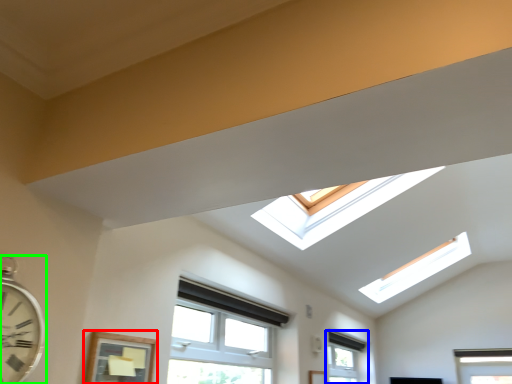
Question: Which is farther away from window (highlighted by a red box)? window (highlighted by a blue box) or clock (highlighted by a green box)?

Choices:
 (A) window
 (B) clock

Answer: (A)